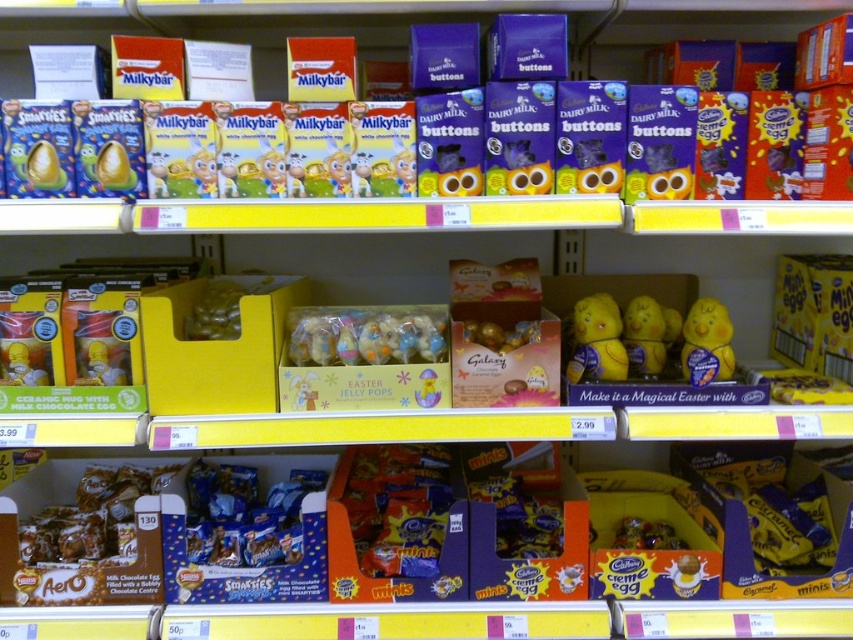
Can you confirm if pastel candy at center is smaller than shiny gold foil wrapped chocolate at center?

Actually, pastel candy at center might be larger than shiny gold foil wrapped chocolate at center.

Can you confirm if pastel candy at center is shorter than shiny gold foil wrapped chocolate at center?

Incorrect, pastel candy at center's height does not fall short of shiny gold foil wrapped chocolate at center's.

Locate an element on the screen. This screenshot has width=853, height=640. pastel candy at center is located at coordinates (366, 333).

Is translucent yellow jelly beans at center thinner than shiny gold foil wrapped chocolate at center?

Yes.

This screenshot has width=853, height=640. What are the coordinates of `translucent yellow jelly beans at center` in the screenshot? It's located at (215, 310).

What are the coordinates of `translucent yellow jelly beans at center` in the screenshot? It's located at (215, 310).

Based on the photo, is pastel candy at center bigger than translucent yellow jelly beans at center?

Yes, pastel candy at center is bigger than translucent yellow jelly beans at center.

How distant is pastel candy at center from translucent yellow jelly beans at center?

A distance of 7.87 inches exists between pastel candy at center and translucent yellow jelly beans at center.

Does point (409, 362) come behind point (207, 330)?

That is False.

Where is `pastel candy at center`? This screenshot has height=640, width=853. pastel candy at center is located at coordinates (366, 333).